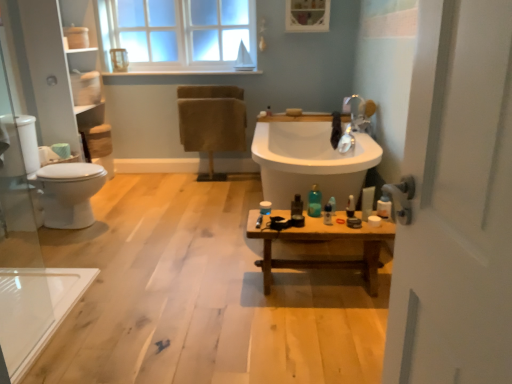
Identify the location of free point below wooden bench at center (from a real-world perspective). The width and height of the screenshot is (512, 384). (312, 280).